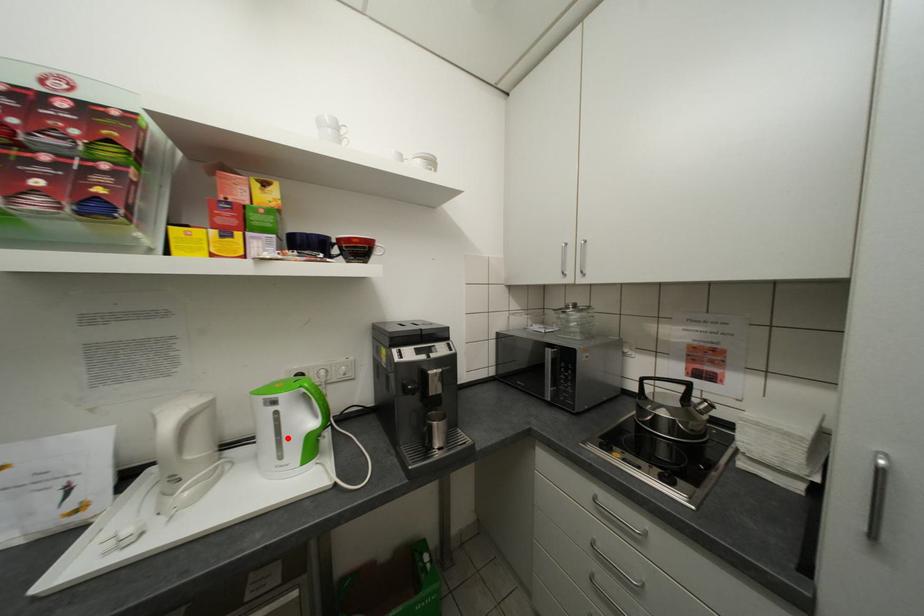
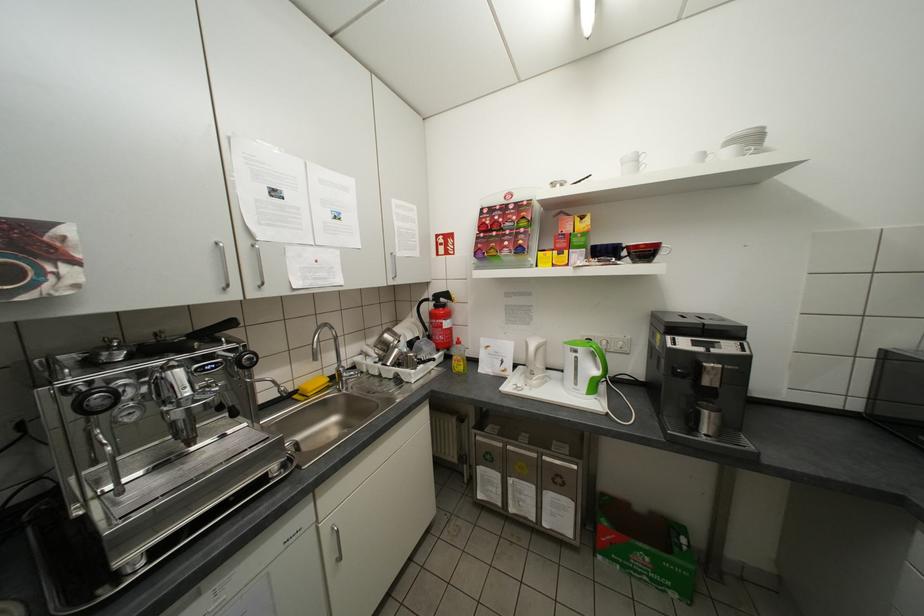
In the second image, find the point that corresponds to the highlighted location in the first image.

(585, 373)